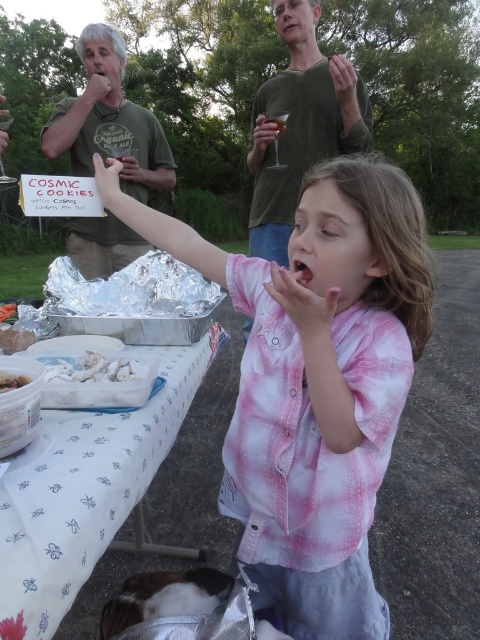
Question: Which of the following is the closest to the observer?

Choices:
 (A) (x=14, y=372)
 (B) (x=0, y=314)
 (C) (x=25, y=337)

Answer: (A)

Question: Can you confirm if green cotton shirt at upper center is thinner than white crumbly cake at center?

Choices:
 (A) no
 (B) yes

Answer: (A)

Question: Which object is the farthest from the white crumbly food at upper left?

Choices:
 (A) white crumbly cookie at center
 (B) white fluffy cloud at center
 (C) pink plaid shirt at center

Answer: (C)

Question: Is white fabric table at lower left bigger than green cotton shirt at upper center?

Choices:
 (A) no
 (B) yes

Answer: (A)

Question: Which object is farther from the camera taking this photo?

Choices:
 (A) white fluffy cloud at center
 (B) green cotton shirt at upper center

Answer: (B)

Question: Is pink plaid shirt at center below green t-shirt at upper left?

Choices:
 (A) no
 (B) yes

Answer: (B)